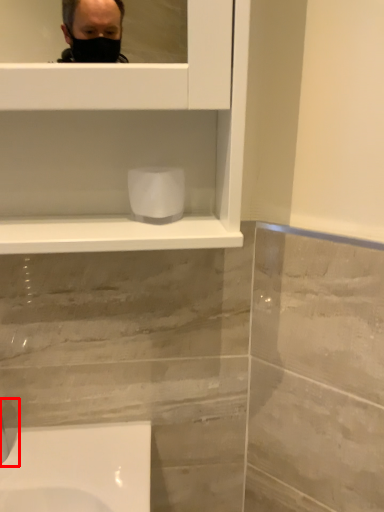
Question: From the image, what is the correct spatial relationship of faucet (annotated by the red box) in relation to toilet paper?

Choices:
 (A) right
 (B) left

Answer: (B)